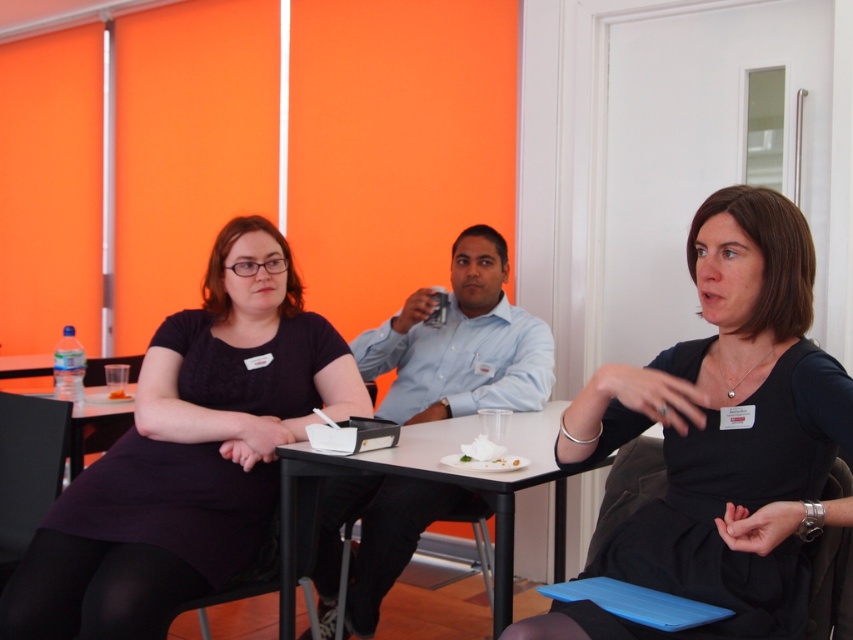
You are standing in the conference room and want to determine which of the two points, point (288, 356) or point (100, 428), is closer to you. Based on the scene, which point is nearer?

Point (288, 356) is closer to the camera than point (100, 428), so it is nearer to you.

You are organizing a fashion show and need to place two dresses on a runway. The runway has a minimum spacing requirement of 40 inches between items. Given the distance between the black matte dress at center and the matte black dress at left, can these two dresses be placed on the runway without violating the spacing rule?

The black matte dress at center is 38.62 inches from the matte black dress at left. Since the required minimum spacing is 40 inches, the dresses are too close to meet the runway requirement.

You are a photographer standing in the room and want to take a photo of the black plastic table at lower left and the white creamy food at table center. Which object will appear larger in your photo?

The black plastic table at lower left will appear larger in the photo because it is closer to the viewer than the white creamy food at table center.